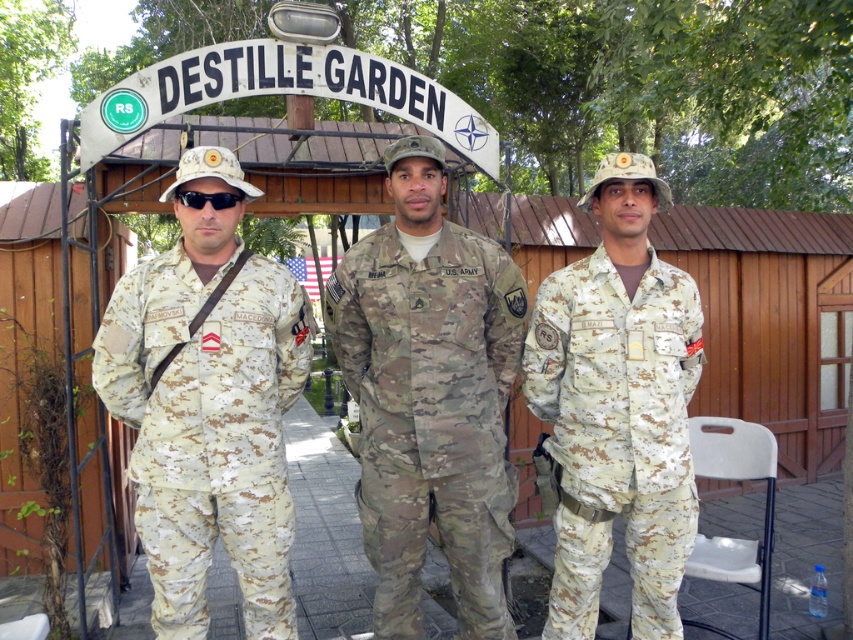
You are observing two soldiers in the image. The first is wearing a camouflage fabric uniform at left, and the second is in a multicam uniform at center. Which soldier appears taller?

The multicam uniform at center is taller than the camouflage fabric uniform at left.

You are a photographer positioned at the origin point of the image. You need to capture a photo of the multicam uniform at center. According to the coordinates provided, in which direction should you aim your camera relative to the center of the image?

The multicam uniform at center is located at point (431, 416), which means it is slightly to the right of the center of the image. Therefore, you should aim your camera slightly to the right of the center to capture it.